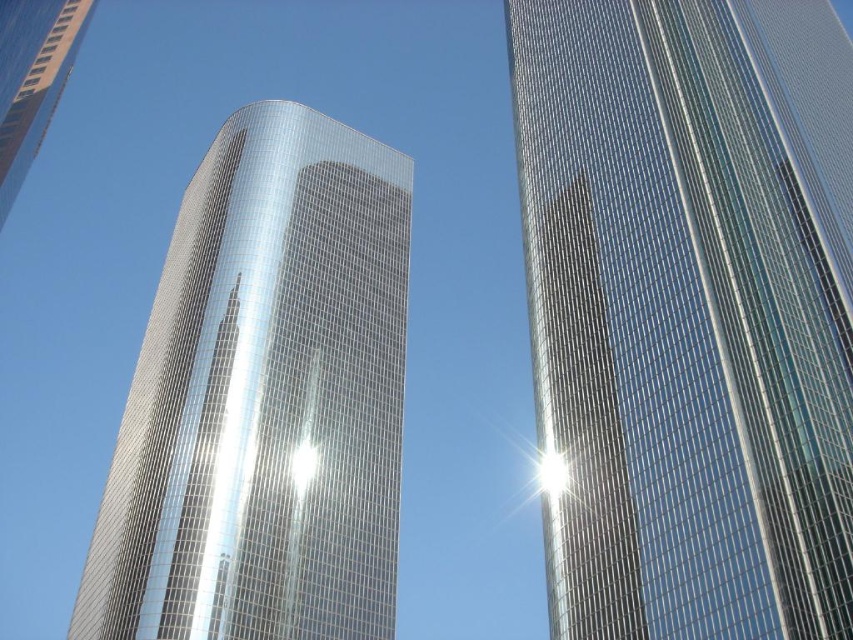
You are a drone operator who needs to fly a drone between the two skyscrapers. The drone has a wingspan of 40 feet. Based on the scene, can the drone safely pass through the gap between the glossy glass skyscraper at center and the metallic glass tower at center?

The distance between the glossy glass skyscraper at center and the metallic glass tower at center is 41.42 feet. Since the drone has a wingspan of 40 feet, there is enough space for it to pass safely between them.

Consider the image. You are standing at the center of the image and want to locate the glossy glass skyscraper at center. What are its coordinates?

The glossy glass skyscraper at center is located at coordinates point (689, 310).